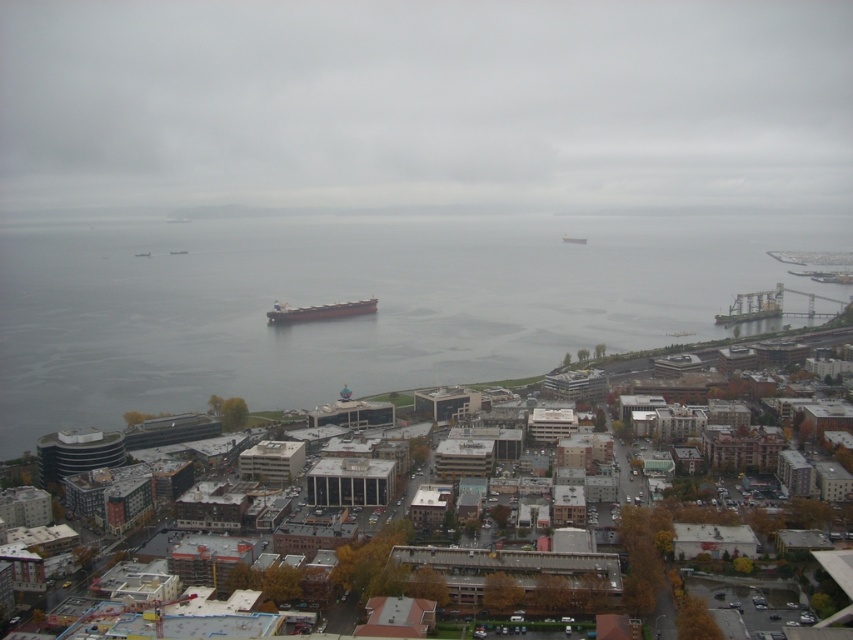
You are a delivery drone flying over the coastal cityscape. You need to land on the smooth concrete harbor at center. However, there is a gray matte cargo ship at center in the way. From your perspective, which object is on the left side to avoid?

The gray matte cargo ship at center is on the left side of the smooth concrete harbor at center, so you should avoid the gray matte cargo ship at center by moving to the right side.

You are standing in the coastal cityscape and want to take a photo of both the point at coordinates (x=323, y=84) and the point at coordinates (x=344, y=316). Which point should you focus on first to ensure both are in focus?

You should focus on the point at coordinates (x=323, y=84) first because it is closer to the camera than the point at coordinates (x=344, y=316), ensuring both points are within the depth of field.

You are a photographer planning to capture the smooth concrete harbor at center and the gray matte cargo ship at center in the same frame. Based on the scene, which object appears taller in the photograph?

The smooth concrete harbor at center is taller than the gray matte cargo ship at center, so it will appear taller in the photograph.